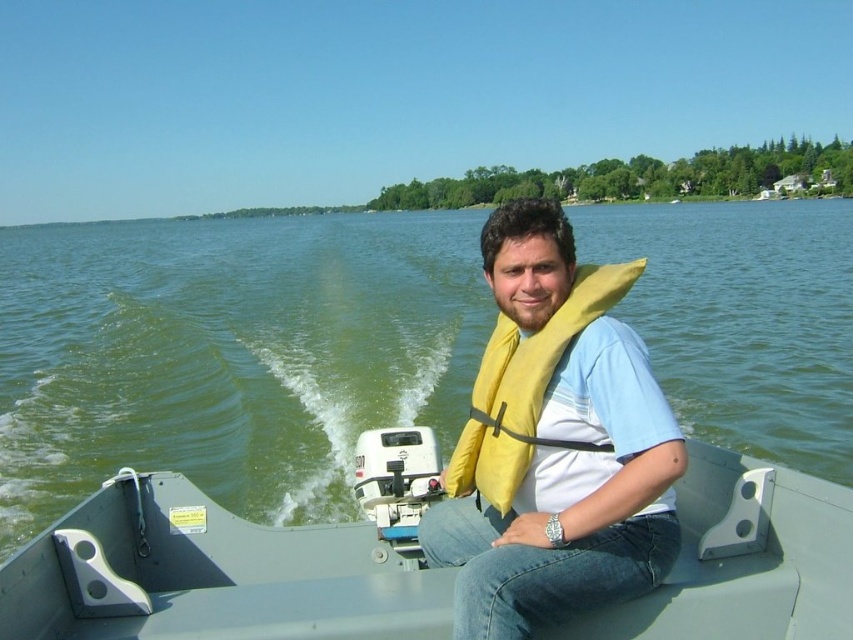
You are a safety inspector checking the motorboat. You notice the green water at center and the yellow fabric life jacket at center. According to safety regulations, the life jacket must be placed to the left of the water area. Is the current placement compliant?

The green water at center is to the right of yellow fabric life jacket at center, so the yellow fabric life jacket at center is positioned to the left of the green water at center. This placement complies with the safety regulation requiring the life jacket to be to the left of the water area.

You are a safety inspector checking the motorboat. According to the image, is the yellow fabric life vest at center properly positioned compared to the green water at center?

The green water at center is much taller than the yellow fabric life vest at center, which means the life vest is not positioned correctly as it should be above the water level for proper use.

You are a passenger on the metallic gray boat at center and need to locate your yellow fabric life vest at center. According to the scene, which side of the boat should you look towards?

The metallic gray boat at center is to the left of the yellow fabric life vest at center, so the life vest is on the right side of the boat.